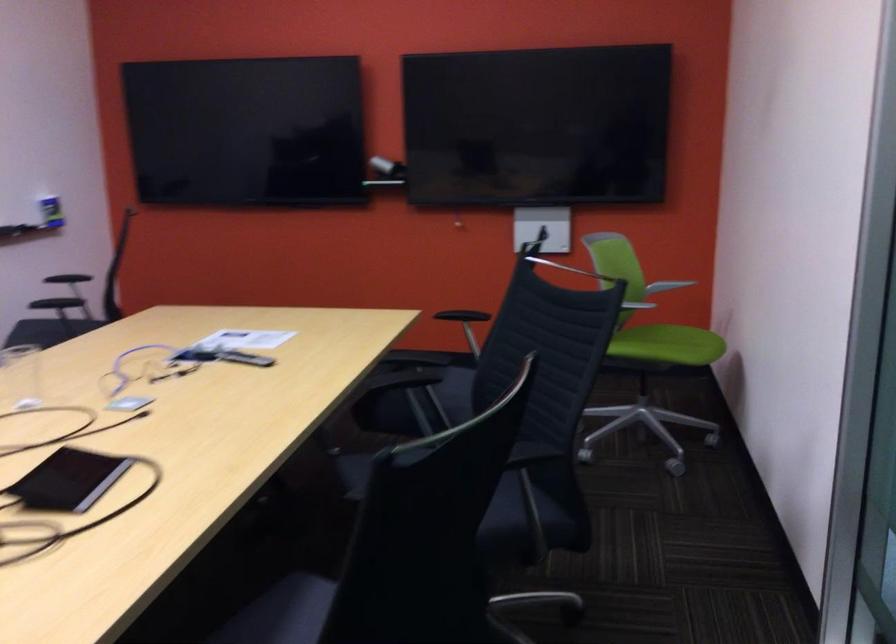
The width and height of the screenshot is (896, 644). I want to click on black chair sitting surface, so click(280, 612).